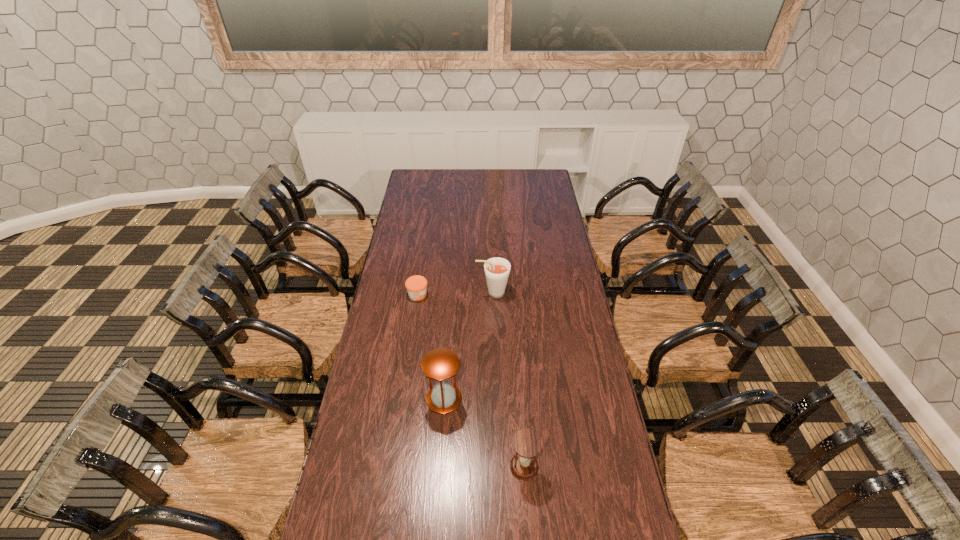
The image size is (960, 540). I want to click on free spot that satisfies the following two spatial constraints: 1. on the drink side of the shorter hourglass; 2. on the left side of the root beer, so click(498, 467).

Find the location of `free space that satisfies the following two spatial constraints: 1. on the drink side of the root beer; 2. on the left side of the nearer hourglass`. free space that satisfies the following two spatial constraints: 1. on the drink side of the root beer; 2. on the left side of the nearer hourglass is located at coordinates (498, 467).

This screenshot has height=540, width=960. I want to click on vacant area that satisfies the following two spatial constraints: 1. on the front label of the second shortest object; 2. on the right side of the leftmost object, so click(x=392, y=467).

Locate an element on the screen. Image resolution: width=960 pixels, height=540 pixels. blank space that satisfies the following two spatial constraints: 1. on the front label of the shortest object; 2. on the left side of the farther hourglass is located at coordinates (402, 399).

The width and height of the screenshot is (960, 540). In order to click on free point that satisfies the following two spatial constraints: 1. on the front label of the taller hourglass; 2. on the left side of the leftmost object in this screenshot , I will do `click(402, 399)`.

This screenshot has height=540, width=960. I want to click on vacant space that satisfies the following two spatial constraints: 1. on the front label of the jam; 2. on the left side of the right hourglass, so click(392, 467).

This screenshot has width=960, height=540. I want to click on vacant region that satisfies the following two spatial constraints: 1. on the back side of the right hourglass; 2. on the drink side of the root beer, so click(511, 293).

Find the location of a particular element. Image resolution: width=960 pixels, height=540 pixels. free region that satisfies the following two spatial constraints: 1. on the front label of the shortest object; 2. on the left side of the nearer hourglass is located at coordinates click(392, 467).

Where is `vacant space that satisfies the following two spatial constraints: 1. on the front side of the nearest object; 2. on the right side of the third farthest object`? The width and height of the screenshot is (960, 540). vacant space that satisfies the following two spatial constraints: 1. on the front side of the nearest object; 2. on the right side of the third farthest object is located at coordinates (439, 467).

This screenshot has height=540, width=960. I want to click on vacant point that satisfies the following two spatial constraints: 1. on the front label of the jam; 2. on the back side of the third object from right to left, so click(402, 399).